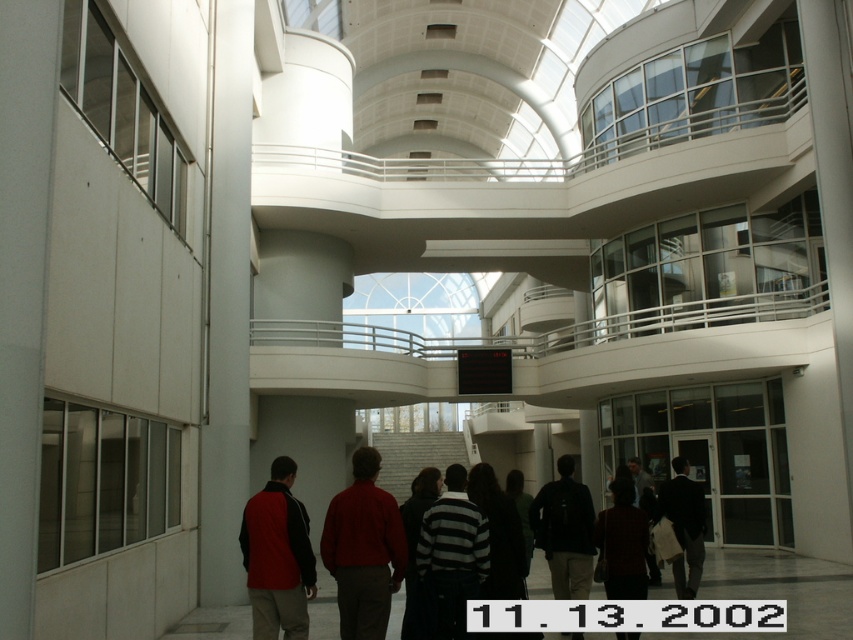
Find the location of a particular element. red matte jacket at center is located at coordinates (363, 548).

What do you see at coordinates (363, 548) in the screenshot? I see `red matte jacket at center` at bounding box center [363, 548].

This screenshot has width=853, height=640. What do you see at coordinates (363, 548) in the screenshot? I see `red matte jacket at center` at bounding box center [363, 548].

The image size is (853, 640). What are the coordinates of `red matte jacket at center` in the screenshot? It's located at (363, 548).

Does matte red jacket at center have a greater width compared to dark brown leather jacket at center?

Yes.

Between matte red jacket at center and dark brown leather jacket at center, which one has more height?

With more height is dark brown leather jacket at center.

Locate an element on the screen. matte red jacket at center is located at coordinates (277, 556).

Does red matte jacket at center have a smaller size compared to striped sweater at center?

Indeed, red matte jacket at center has a smaller size compared to striped sweater at center.

Find the location of a particular element. The width and height of the screenshot is (853, 640). red matte jacket at center is located at coordinates (363, 548).

I want to click on red matte jacket at center, so click(x=363, y=548).